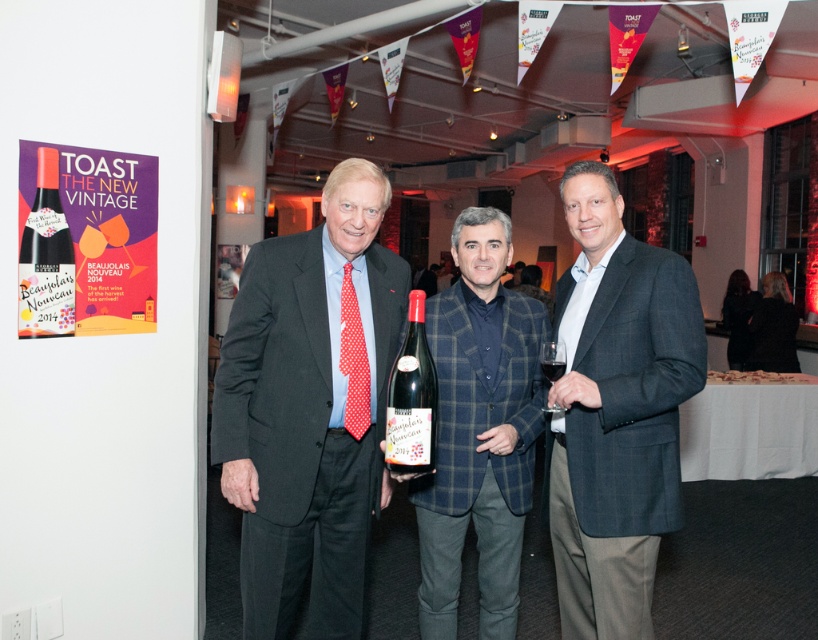
You are standing in the room and want to reach a point that is exactly 6.88 feet away from you. Can you confirm if the point at coordinates point (571, 582) is exactly at that distance?

The distance of point (571, 582) from viewer is 6.88 feet, so yes, the point at coordinates point 0.911, 0.969 is exactly at that distance.

You are a photographer at the event and need to ensure both the plaid wool blazer at center and the clear glass wine at center are visible in your shot. Given their sizes, which object will require more vertical space in the frame?

The plaid wool blazer at center requires more vertical space in the frame because it has a greater height compared to the clear glass wine at center.

You are a photographer setting up for the event. You need to ensure that the dark gray textured blazer at center and the transparent glass at center are both visible in the frame. Which object should you focus on first to ensure it is fully in the frame?

The dark gray textured blazer at center is taller than the transparent glass at center, so you should focus on the dark gray textured blazer at center first to ensure it fits within the frame.